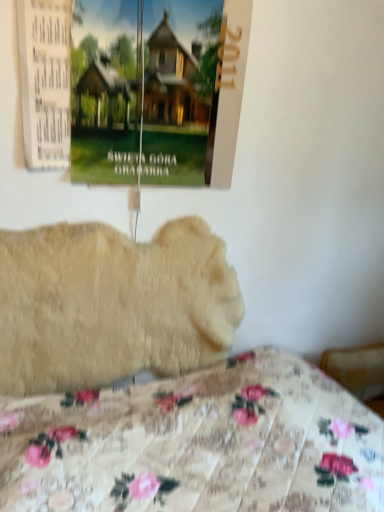
In order to face matte paper poster at upper left, should I rotate leftwards or rightwards?

Turn left by 7.857 degrees to look at matte paper poster at upper left.

Find the location of `fluffy beige dog at center`. fluffy beige dog at center is located at coordinates (111, 304).

Is fluffy beige dog at center bigger or smaller than matte paper poster at upper left?

In the image, fluffy beige dog at center appears to be larger than matte paper poster at upper left.

Is fluffy beige dog at center to the right of matte paper poster at upper left from the viewer's perspective?

No.

From the image's perspective, which is above, fluffy beige dog at center or matte paper poster at upper left?

matte paper poster at upper left, from the image's perspective.

What's the angular difference between fluffy beige dog at center and matte paper poster at upper left's facing directions?

fluffy beige dog at center and matte paper poster at upper left are facing 0.0351 degrees away from each other.

Is fluffy beige dog at center bigger than floral fabric bed at lower center?

Incorrect, fluffy beige dog at center is not larger than floral fabric bed at lower center.

Is fluffy beige dog at center looking in the opposite direction of floral fabric bed at lower center?

No.

Would you say fluffy beige dog at center contains floral fabric bed at lower center?

Actually, floral fabric bed at lower center is outside fluffy beige dog at center.

Looking at this image, which of these two, floral fabric bed at lower center or matte paper poster at upper left, is bigger?

floral fabric bed at lower center is bigger.

Consider the image. Is floral fabric bed at lower center far away from matte paper poster at upper left?

No, floral fabric bed at lower center is not far from matte paper poster at upper left.

Is floral fabric bed at lower center oriented towards matte paper poster at upper left?

No, floral fabric bed at lower center is not oriented towards matte paper poster at upper left.

Relative to matte paper poster at upper left, is floral fabric bed at lower center in front or behind?

Clearly, floral fabric bed at lower center is in front of matte paper poster at upper left.

Which object is further away from the camera, matte paper poster at upper left or fluffy beige dog at center?

fluffy beige dog at center.

Would you consider matte paper poster at upper left to be distant from fluffy beige dog at center?

They are positioned close to each other.

Is matte paper poster at upper left to the left of fluffy beige dog at center from the viewer's perspective?

In fact, matte paper poster at upper left is to the right of fluffy beige dog at center.

Is matte paper poster at upper left spatially inside fluffy beige dog at center, or outside of it?

matte paper poster at upper left is spatially situated outside fluffy beige dog at center.

Which is behind, point (316, 432) or point (156, 348)?

The point (156, 348) is behind.

From a real-world perspective, is floral fabric bed at lower center above or below fluffy beige dog at center?

floral fabric bed at lower center is situated lower than fluffy beige dog at center in the real world.

How distant is floral fabric bed at lower center from fluffy beige dog at center?

35.80 centimeters.

Can you tell me how much floral fabric bed at lower center and fluffy beige dog at center differ in facing direction?

1.13 degrees separate the facing orientations of floral fabric bed at lower center and fluffy beige dog at center.

From the image's perspective, which one is positioned higher, matte paper poster at upper left or floral fabric bed at lower center?

matte paper poster at upper left is shown above in the image.

Does matte paper poster at upper left lie behind floral fabric bed at lower center?

Yes, the depth of matte paper poster at upper left is greater than that of floral fabric bed at lower center.

Considering the positions of objects matte paper poster at upper left and floral fabric bed at lower center in the image provided, who is more to the right, matte paper poster at upper left or floral fabric bed at lower center?

Positioned to the right is floral fabric bed at lower center.

Who is shorter, matte paper poster at upper left or floral fabric bed at lower center?

floral fabric bed at lower center.

Where is `poster page in front of the fluffy beige dog at center`? poster page in front of the fluffy beige dog at center is located at coordinates (134, 89).

This screenshot has width=384, height=512. I want to click on bed below the fluffy beige dog at center (from the image's perspective), so click(x=197, y=444).

When comparing their distances from matte paper poster at upper left, does fluffy beige dog at center or floral fabric bed at lower center seem closer?

The object closer to matte paper poster at upper left is fluffy beige dog at center.

Which object lies nearer to the anchor point floral fabric bed at lower center, fluffy beige dog at center or matte paper poster at upper left?

Based on the image, fluffy beige dog at center appears to be nearer to floral fabric bed at lower center.

Estimate the real-world distances between objects in this image. Which object is further from floral fabric bed at lower center, matte paper poster at upper left or fluffy beige dog at center?

The object further to floral fabric bed at lower center is matte paper poster at upper left.

From the image, which object appears to be nearer to fluffy beige dog at center, matte paper poster at upper left or floral fabric bed at lower center?

Based on the image, floral fabric bed at lower center appears to be nearer to fluffy beige dog at center.

From the image, which object appears to be nearer to fluffy beige dog at center, floral fabric bed at lower center or matte paper poster at upper left?

floral fabric bed at lower center is positioned closer to the anchor fluffy beige dog at center.

Looking at the image, which one is located further to matte paper poster at upper left, floral fabric bed at lower center or fluffy beige dog at center?

floral fabric bed at lower center.

What are the coordinates of `animal between matte paper poster at upper left and floral fabric bed at lower center in the up-down direction` in the screenshot? It's located at (111, 304).